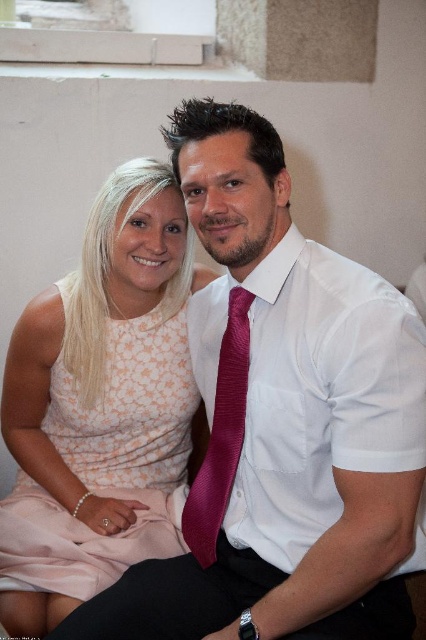
Question: Can you confirm if pink lace dress at center is positioned below satin burgundy tie at center?

Choices:
 (A) yes
 (B) no

Answer: (B)

Question: Which object is closer to the camera taking this photo?

Choices:
 (A) satin burgundy tie at center
 (B) pink lace dress at center
 (C) white satin dress shirt at center

Answer: (C)

Question: Does pink lace dress at center appear under satin burgundy tie at center?

Choices:
 (A) no
 (B) yes

Answer: (A)

Question: Is pink lace dress at center thinner than satin burgundy tie at center?

Choices:
 (A) no
 (B) yes

Answer: (A)

Question: Estimate the real-world distances between objects in this image. Which object is farther from the pink lace dress at center?

Choices:
 (A) white satin dress shirt at center
 (B) satin burgundy tie at center

Answer: (A)

Question: Which point is farther to the camera?

Choices:
 (A) (109, 346)
 (B) (365, 404)

Answer: (A)